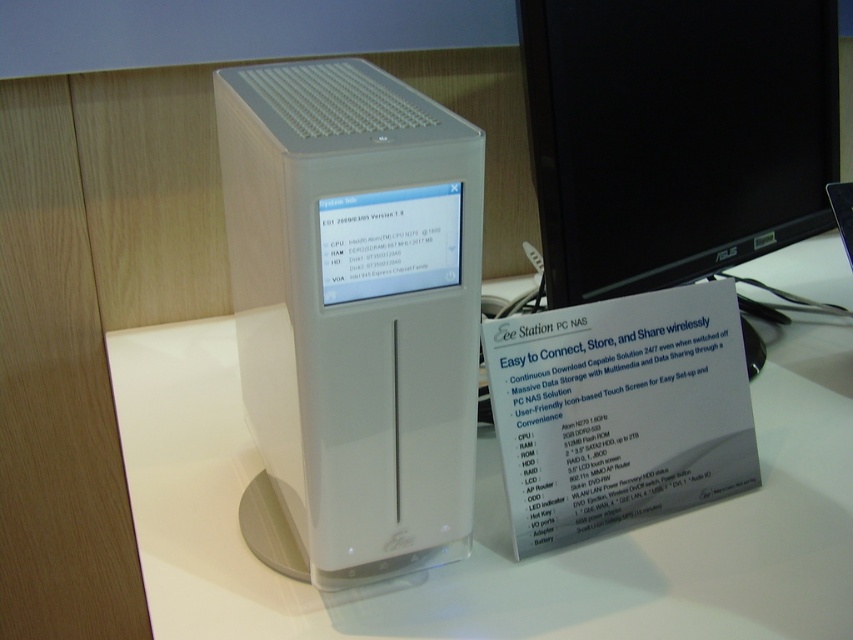
Question: Does white plastic computer desk at center have a lesser width compared to white plastic computer tower at center?

Choices:
 (A) no
 (B) yes

Answer: (A)

Question: Estimate the real-world distances between objects in this image. Which object is farther from the white plastic computer desk at center?

Choices:
 (A) white plastic computer tower at center
 (B) black glossy monitor at upper right

Answer: (B)

Question: Which point is farther from the camera taking this photo?

Choices:
 (A) (682, 51)
 (B) (345, 580)
 (C) (822, 612)

Answer: (A)

Question: Is white plastic computer tower at center below black glossy monitor at upper right?

Choices:
 (A) yes
 (B) no

Answer: (A)

Question: Among these points, which one is farthest from the camera?

Choices:
 (A) (793, 92)
 (B) (778, 394)

Answer: (A)

Question: Can you confirm if white plastic computer desk at center is bigger than black glossy monitor at upper right?

Choices:
 (A) no
 (B) yes

Answer: (B)